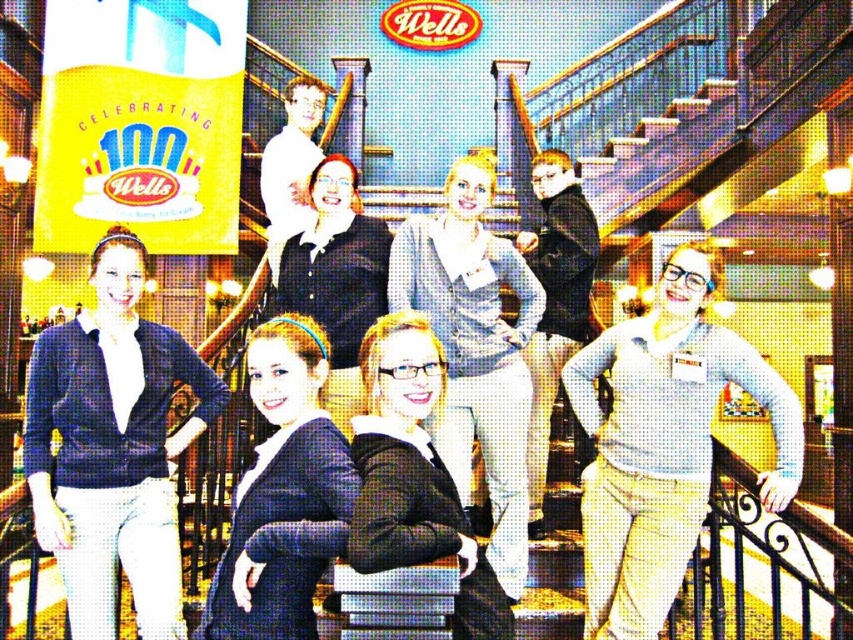
Is dark blue blazer at center closer to camera compared to black sweater at center?

That is True.

Can you confirm if dark blue blazer at center is positioned to the right of black sweater at center?

Incorrect, dark blue blazer at center is not on the right side of black sweater at center.

Who is more forward, [338,480] or [560,307]?

Point [338,480] is more forward.

Identify the location of dark blue blazer at center. (283, 493).

Which of these two, matte navy cardigan at center or dark blue blazer at center, stands taller?

matte navy cardigan at center is taller.

Who is higher up, matte navy cardigan at center or dark blue blazer at center?

matte navy cardigan at center is above.

Image resolution: width=853 pixels, height=640 pixels. What do you see at coordinates (112, 449) in the screenshot? I see `matte navy cardigan at center` at bounding box center [112, 449].

Identify the location of matte navy cardigan at center. The height and width of the screenshot is (640, 853). (112, 449).

Looking at this image, does light blue sweater at center appear on the left side of matte black sweater at center?

No, light blue sweater at center is not to the left of matte black sweater at center.

Describe the element at coordinates (663, 444) in the screenshot. The width and height of the screenshot is (853, 640). I see `light blue sweater at center` at that location.

Where is `light blue sweater at center`? light blue sweater at center is located at coordinates (663, 444).